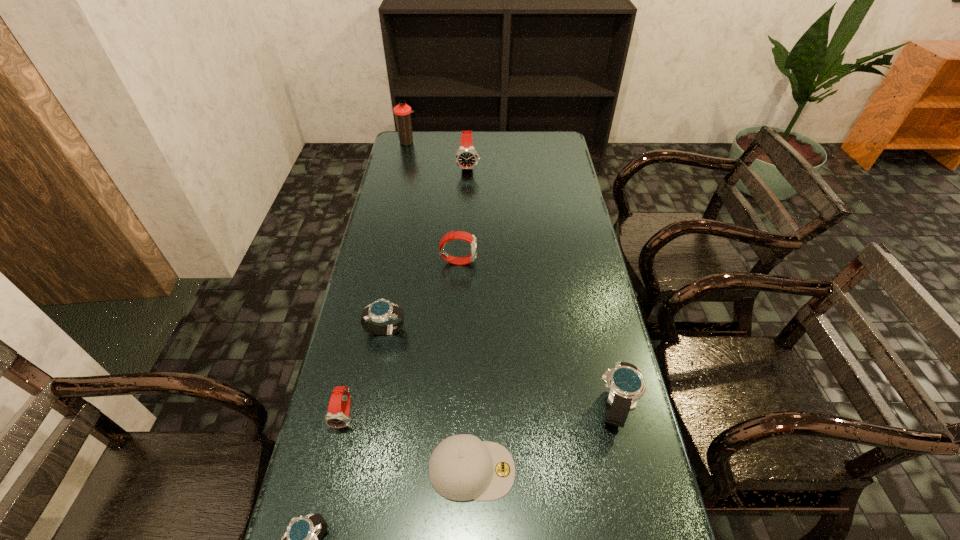
Find the location of a particular element. This screenshot has width=960, height=540. thermos bottle is located at coordinates (402, 111).

Where is `the farthest object`? the farthest object is located at coordinates (402, 111).

In order to click on the seventh nearest object in this screenshot , I will do `click(466, 158)`.

Identify the location of the seventh shortest object. The width and height of the screenshot is (960, 540). (466, 158).

Where is `the biggest silver watch`? The image size is (960, 540). the biggest silver watch is located at coordinates (626, 386).

I want to click on the rightmost watch, so click(x=626, y=386).

You are a GUI agent. You are given a task and a screenshot of the screen. Output one action in this format:
    pyautogui.click(x=<x>, y=<y>)
    Task: Click on the second farthest watch
    
    Given the screenshot: What is the action you would take?
    pyautogui.click(x=462, y=235)

Identify the location of the sixth nearest object. (462, 235).

You are a GUI agent. You are given a task and a screenshot of the screen. Output one action in this format:
    pyautogui.click(x=<x>, y=<y>)
    Task: Click on the fifth nearest object
    The width and height of the screenshot is (960, 540).
    Given the screenshot: What is the action you would take?
    pyautogui.click(x=381, y=310)

What are the coordinates of `the farthest silver watch` in the screenshot? It's located at (381, 310).